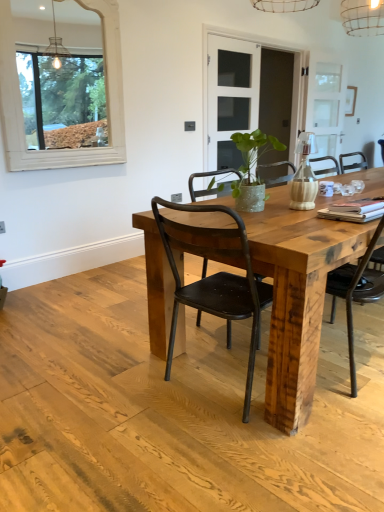
Question: Considering the relative sizes of reclaimed wood table at center and matte white vase at center in the image provided, is reclaimed wood table at center shorter than matte white vase at center?

Choices:
 (A) no
 (B) yes

Answer: (A)

Question: Is reclaimed wood table at center taller than matte white vase at center?

Choices:
 (A) yes
 (B) no

Answer: (A)

Question: From the image's perspective, is reclaimed wood table at center on top of matte white vase at center?

Choices:
 (A) yes
 (B) no

Answer: (B)

Question: Is reclaimed wood table at center in front of matte white vase at center?

Choices:
 (A) no
 (B) yes

Answer: (B)

Question: Would you consider reclaimed wood table at center to be distant from matte white vase at center?

Choices:
 (A) no
 (B) yes

Answer: (A)

Question: Is point coord(231,108) positioned closer to the camera than point coord(304,200)?

Choices:
 (A) farther
 (B) closer

Answer: (A)

Question: From the image's perspective, relative to matte white vase at center, is clear glass door at center above or below?

Choices:
 (A) below
 (B) above

Answer: (B)

Question: Relative to matte white vase at center, is clear glass door at center in front or behind?

Choices:
 (A) front
 (B) behind

Answer: (B)

Question: Considering the positions of clear glass door at center and matte white vase at center in the image, is clear glass door at center taller or shorter than matte white vase at center?

Choices:
 (A) short
 (B) tall

Answer: (B)

Question: Looking at their shapes, would you say green textured vase at center is wider or thinner than reclaimed wood table at center?

Choices:
 (A) wide
 (B) thin

Answer: (B)

Question: From the image's perspective, is green textured vase at center positioned above or below reclaimed wood table at center?

Choices:
 (A) above
 (B) below

Answer: (A)

Question: Is green textured vase at center inside the boundaries of reclaimed wood table at center, or outside?

Choices:
 (A) inside
 (B) outside

Answer: (B)

Question: Is green textured vase at center bigger or smaller than reclaimed wood table at center?

Choices:
 (A) small
 (B) big

Answer: (A)

Question: In the image, is matte white vase at center positioned in front of or behind white wooden frame at upper left?

Choices:
 (A) behind
 (B) front

Answer: (B)

Question: Is matte white vase at center bigger or smaller than white wooden frame at upper left?

Choices:
 (A) big
 (B) small

Answer: (B)